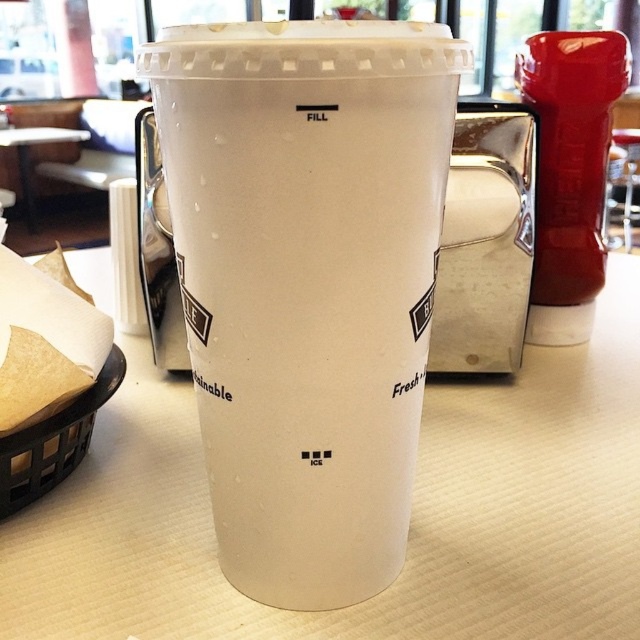
You are looking at the cup and notice two points marked on it. The first point is at coordinates point (385, 387) and the second is at point (132, 324). Which point is closer to you?

A: Point (385, 387) is closer to the camera than point (132, 324).